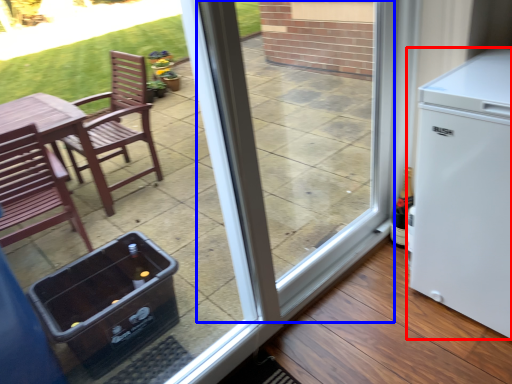
Question: Which object is further to the camera taking this photo, refrigerator (highlighted by a red box) or screen door (highlighted by a blue box)?

Choices:
 (A) refrigerator
 (B) screen door

Answer: (A)